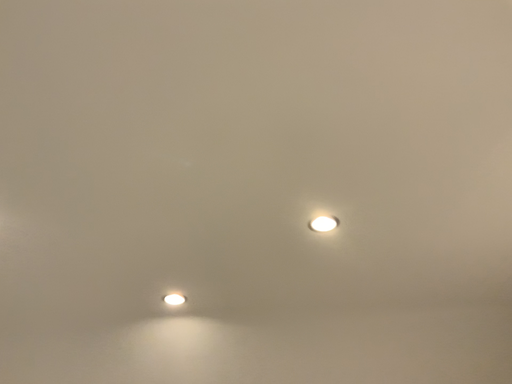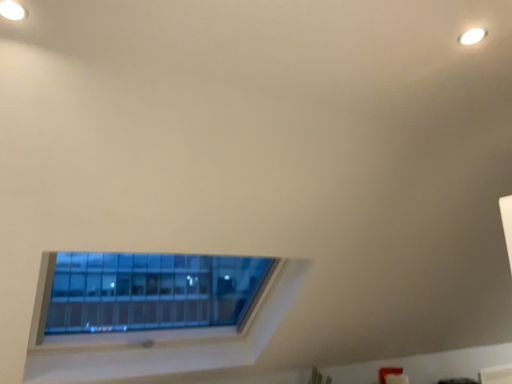
Question: Which way did the camera rotate in the video?

Choices:
 (A) rotated left
 (B) rotated right

Answer: (B)